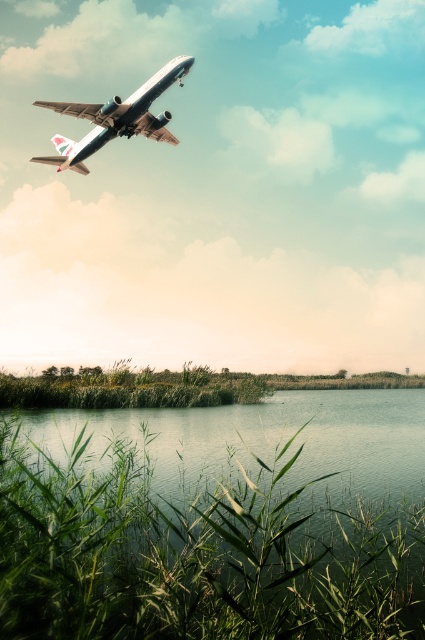
Which is behind, point (129, 536) or point (85, 112)?

The point (85, 112) is behind.

Can you confirm if green leafy reeds at lower center is positioned to the left of metallic silver airplane at upper left?

Incorrect, green leafy reeds at lower center is not on the left side of metallic silver airplane at upper left.

The image size is (425, 640). What are the coordinates of `green leafy reeds at lower center` in the screenshot? It's located at (197, 556).